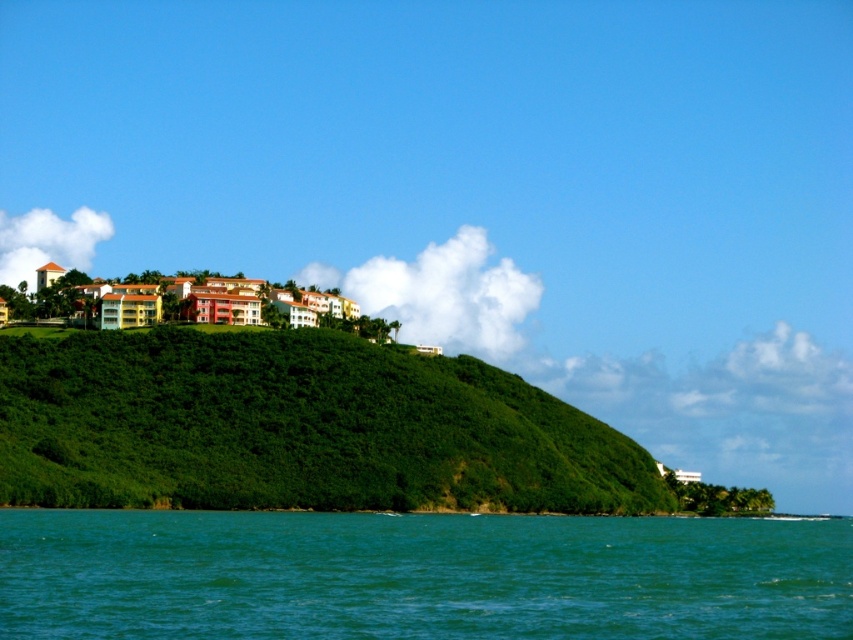
Question: Does teal glossy water at lower center lie in front of green leafy hillside at center?

Choices:
 (A) yes
 (B) no

Answer: (A)

Question: Does teal glossy water at lower center lie in front of green leafy hillside at center?

Choices:
 (A) no
 (B) yes

Answer: (B)

Question: Is teal glossy water at lower center further to the viewer compared to green leafy hillside at center?

Choices:
 (A) yes
 (B) no

Answer: (B)

Question: Which of the following is the farthest from the observer?

Choices:
 (A) (428, 538)
 (B) (152, 388)

Answer: (B)

Question: Which of the following is the closest to the observer?

Choices:
 (A) (412, 413)
 (B) (395, 630)

Answer: (B)